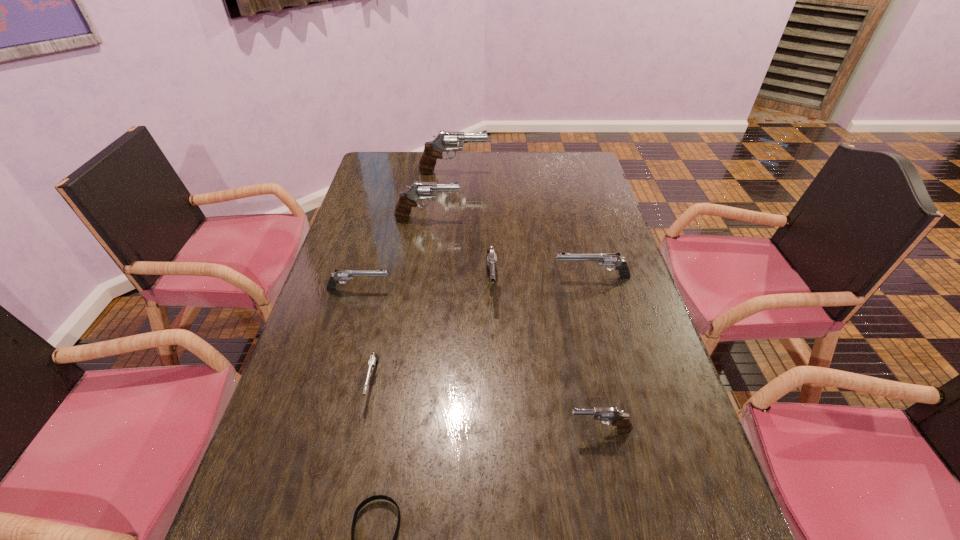
The height and width of the screenshot is (540, 960). Find the location of `the tallest pistol`. the tallest pistol is located at coordinates [433, 150].

At what (x,y) coordinates should I click in order to perform the action: click on the farthest pistol. Please return your answer as a coordinate pair (x, y). The width and height of the screenshot is (960, 540). Looking at the image, I should click on pyautogui.click(x=433, y=150).

The width and height of the screenshot is (960, 540). I want to click on the third smallest gray pistol, so click(419, 190).

Find the location of a particular element. the second farthest gray pistol is located at coordinates (419, 190).

Find the location of a particular element. the third farthest gray pistol is located at coordinates (491, 259).

This screenshot has height=540, width=960. I want to click on the sixth shortest object, so click(x=491, y=259).

At what (x,y) coordinates should I click in order to perform the action: click on the biggest silver pistol. Please return your answer as a coordinate pair (x, y). Looking at the image, I should click on (604, 259).

You are a GUI agent. You are given a task and a screenshot of the screen. Output one action in this format:
    pyautogui.click(x=<x>, y=<y>)
    Task: Click on the rightmost silver pistol
    The height and width of the screenshot is (540, 960).
    Given the screenshot: What is the action you would take?
    pyautogui.click(x=604, y=259)

Where is `the second nearest object`? the second nearest object is located at coordinates (621, 419).

You are a GUI agent. You are given a task and a screenshot of the screen. Output one action in this format:
    pyautogui.click(x=<x>, y=<y>)
    Task: Click on the rightmost gray pistol
    
    Given the screenshot: What is the action you would take?
    pyautogui.click(x=621, y=419)